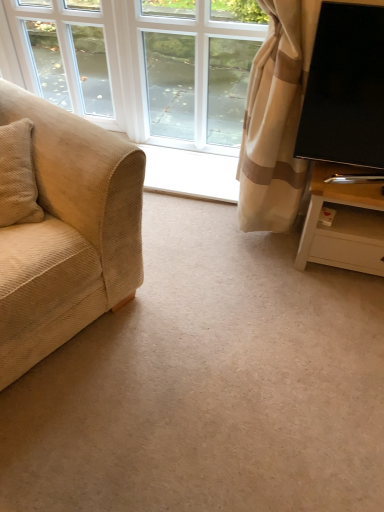
You are a GUI agent. You are given a task and a screenshot of the screen. Output one action in this format:
    pyautogui.click(x=<x>, y=<y>)
    Task: Click on the white glass window at upper left, which is counted as the second window, starting from the right
    Image resolution: width=384 pixels, height=512 pixels.
    Given the screenshot: What is the action you would take?
    pyautogui.click(x=63, y=56)

Where is `beige corduroy couch at left`? This screenshot has height=512, width=384. beige corduroy couch at left is located at coordinates (62, 227).

The image size is (384, 512). I want to click on white wood tv stand at right, so click(x=344, y=223).

Considering the relative sizes of white glass window at upper left, which is counted as the second window, starting from the right, and white glass window at center, the 2th window positioned from the left, in the image provided, is white glass window at upper left, which is counted as the second window, starting from the right, taller than white glass window at center, the 2th window positioned from the left,?

In fact, white glass window at upper left, which is counted as the second window, starting from the right, may be shorter than white glass window at center, the 2th window positioned from the left.

From the image's perspective, is white glass window at upper left, which is counted as the second window, starting from the right, beneath white glass window at center, the 1th window viewed from the right?

No, from the image's perspective, white glass window at upper left, which is counted as the second window, starting from the right, is not below white glass window at center, the 1th window viewed from the right.

Can you confirm if white glass window at upper left, which is counted as the second window, starting from the right, is bigger than white glass window at center, the 1th window viewed from the right?

Yes, white glass window at upper left, which is counted as the second window, starting from the right, is bigger than white glass window at center, the 1th window viewed from the right.

Does point (36, 11) come in front of point (87, 6)?

That is True.

Is point (138, 25) closer or farther from the camera than point (342, 237)?

Clearly, point (138, 25) is more distant from the camera than point (342, 237).

Is white glass window at center, the 2th window positioned from the left, in front of or behind white wood tv stand at right in the image?

Clearly, white glass window at center, the 2th window positioned from the left, is behind white wood tv stand at right.

Is white glass window at center, the 1th window viewed from the right, wider than white wood tv stand at right?

In fact, white glass window at center, the 1th window viewed from the right, might be narrower than white wood tv stand at right.

Is white glass window at center, the 2th window positioned from the left, located outside white wood tv stand at right?

Yes, white glass window at center, the 2th window positioned from the left, is located beyond the bounds of white wood tv stand at right.

Which is in front, point (375, 143) or point (87, 175)?

Positioned in front is point (87, 175).

Based on the photo, is black glossy tv at right positioned with its back to beige corduroy couch at left?

No.

Considering the positions of objects black glossy tv at right and beige corduroy couch at left in the image provided, who is more to the right, black glossy tv at right or beige corduroy couch at left?

From the viewer's perspective, black glossy tv at right appears more on the right side.

Is black glossy tv at right taller or shorter than beige corduroy couch at left?

Clearly, black glossy tv at right is shorter compared to beige corduroy couch at left.

Is white glass window at center, the 1th window viewed from the right, facing away from black glossy tv at right?

No, black glossy tv at right is not at the back of white glass window at center, the 1th window viewed from the right.

From the image's perspective, is white glass window at center, the 2th window positioned from the left, located above or below black glossy tv at right?

white glass window at center, the 2th window positioned from the left, is above black glossy tv at right.

Which is more to the left, white glass window at center, the 1th window viewed from the right, or black glossy tv at right?

Positioned to the left is white glass window at center, the 1th window viewed from the right.

Considering the relative sizes of beige corduroy couch at left and black glossy tv at right in the image provided, is beige corduroy couch at left wider than black glossy tv at right?

Indeed, beige corduroy couch at left has a greater width compared to black glossy tv at right.

Is beige corduroy couch at left far away from black glossy tv at right?

Actually, beige corduroy couch at left and black glossy tv at right are a little close together.

Is black glossy tv at right surrounded by beige corduroy couch at left?

Actually, black glossy tv at right is outside beige corduroy couch at left.

In terms of height, does beige corduroy couch at left look taller or shorter compared to black glossy tv at right?

In the image, beige corduroy couch at left appears to be taller than black glossy tv at right.

Is beige corduroy couch at left turned away from white wood tv stand at right?

No, beige corduroy couch at left is not facing away from white wood tv stand at right.

Considering the positions of objects beige corduroy couch at left and white wood tv stand at right in the image provided, who is more to the left, beige corduroy couch at left or white wood tv stand at right?

From the viewer's perspective, beige corduroy couch at left appears more on the left side.

Between point (24, 153) and point (310, 184), which one is positioned behind?

Point (310, 184)

Considering the sizes of beige corduroy couch at left and white wood tv stand at right in the image, is beige corduroy couch at left wider or thinner than white wood tv stand at right?

In the image, beige corduroy couch at left appears to be wider than white wood tv stand at right.

Is black glossy tv at right in front of or behind white wood tv stand at right in the image?

In the image, black glossy tv at right appears in front of white wood tv stand at right.

How much distance is there between black glossy tv at right and white wood tv stand at right?

A distance of 29.48 centimeters exists between black glossy tv at right and white wood tv stand at right.

From a real-world perspective, is black glossy tv at right below white wood tv stand at right?

No, from a real-world perspective, black glossy tv at right is not beneath white wood tv stand at right.

Are black glossy tv at right and white wood tv stand at right beside each other?

black glossy tv at right and white wood tv stand at right are clearly separated.

Locate an element on the screen. window located above the white glass window at center, the 2th window positioned from the left (from the image's perspective) is located at coordinates [63, 56].

At what (x,y) coordinates should I click in order to perform the action: click on the 1st window directly above the white wood tv stand at right (from a real-world perspective). Please return your answer as a coordinate pair (x, y). This screenshot has width=384, height=512. Looking at the image, I should click on tap(144, 64).

Estimate the real-world distances between objects in this image. Which object is closer to white glass window at upper left, positioned as the first window in left-to-right order, white glass window at center, the 1th window viewed from the right, or black glossy tv at right?

white glass window at center, the 1th window viewed from the right, lies closer to white glass window at upper left, positioned as the first window in left-to-right order, than the other object.

Considering their positions, is white glass window at upper left, which is counted as the second window, starting from the right, positioned further to black glossy tv at right than white wood tv stand at right?

white glass window at upper left, which is counted as the second window, starting from the right.

When comparing their distances from white wood tv stand at right, does white glass window at upper left, which is counted as the second window, starting from the right, or white glass window at center, the 2th window positioned from the left, seem further?

white glass window at center, the 2th window positioned from the left, lies further to white wood tv stand at right than the other object.

When comparing their distances from black glossy tv at right, does white glass window at center, the 1th window viewed from the right, or white glass window at upper left, positioned as the first window in left-to-right order, seem further?

white glass window at center, the 1th window viewed from the right, is further to black glossy tv at right.

Looking at the image, which one is located further to beige corduroy couch at left, white glass window at center, the 1th window viewed from the right, or black glossy tv at right?

Among the two, white glass window at center, the 1th window viewed from the right, is located further to beige corduroy couch at left.

Which object lies nearer to the anchor point white glass window at center, the 1th window viewed from the right, black glossy tv at right or white glass window at upper left, positioned as the first window in left-to-right order?

white glass window at upper left, positioned as the first window in left-to-right order, lies closer to white glass window at center, the 1th window viewed from the right, than the other object.

Based on their spatial positions, is white glass window at upper left, which is counted as the second window, starting from the right, or white glass window at center, the 1th window viewed from the right, further from beige corduroy couch at left?

white glass window at center, the 1th window viewed from the right.

When comparing their distances from white glass window at upper left, which is counted as the second window, starting from the right, does white glass window at center, the 1th window viewed from the right, or white wood tv stand at right seem closer?

white glass window at center, the 1th window viewed from the right.

Image resolution: width=384 pixels, height=512 pixels. I want to click on window located between white glass window at upper left, which is counted as the second window, starting from the right, and white wood tv stand at right in the left-right direction, so click(144, 64).

Locate an element on the screen. This screenshot has height=512, width=384. window located between white glass window at upper left, which is counted as the second window, starting from the right, and black glossy tv at right in the left-right direction is located at coordinates (144, 64).

Identify the location of window between beige corduroy couch at left and white glass window at upper left, positioned as the first window in left-to-right order, in the front-back direction. coord(144,64).

This screenshot has height=512, width=384. Find the location of `television between white glass window at center, the 2th window positioned from the left, and white wood tv stand at right vertically`. television between white glass window at center, the 2th window positioned from the left, and white wood tv stand at right vertically is located at coordinates (345, 88).